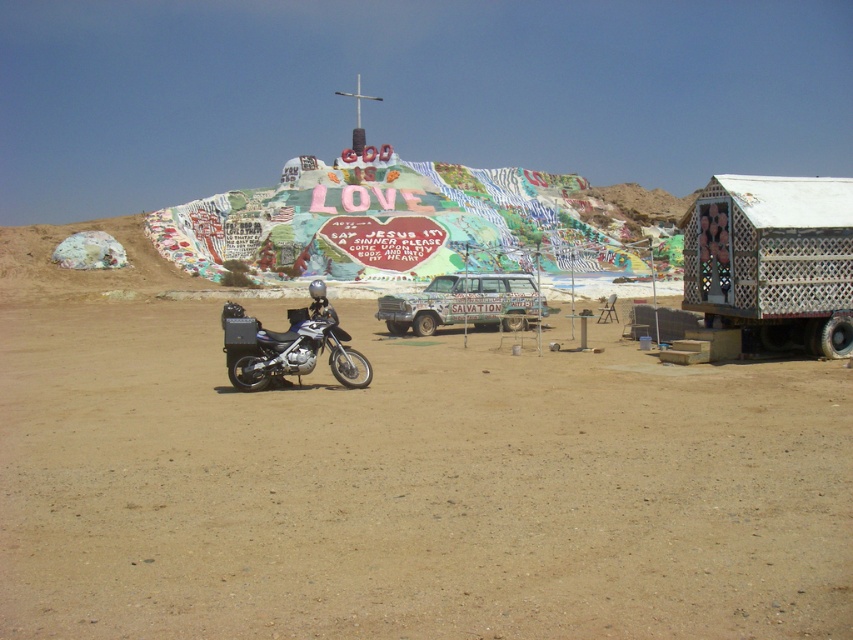
Question: Which object is the farthest from the metallic blue motorcycle at lower left?

Choices:
 (A) rustic wood paneling car at center
 (B) white lattice hut at right
 (C) brown sandy ground at center

Answer: (A)

Question: Is white lattice hut at right behind metallic blue motorcycle at lower left?

Choices:
 (A) yes
 (B) no

Answer: (A)

Question: Can you confirm if white lattice hut at right is smaller than metallic blue motorcycle at lower left?

Choices:
 (A) yes
 (B) no

Answer: (A)

Question: Based on their relative distances, which object is nearer to the brown sandy ground at center?

Choices:
 (A) rustic wood paneling car at center
 (B) metallic blue motorcycle at lower left
 (C) white lattice hut at right

Answer: (B)

Question: Does brown sandy ground at center have a smaller size compared to white lattice hut at right?

Choices:
 (A) no
 (B) yes

Answer: (A)

Question: Estimate the real-world distances between objects in this image. Which object is closer to the white lattice hut at right?

Choices:
 (A) rustic wood paneling car at center
 (B) brown sandy ground at center
 (C) metallic blue motorcycle at lower left

Answer: (A)